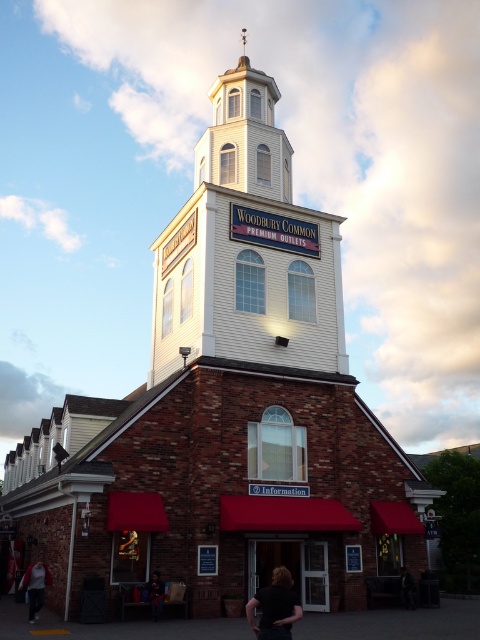
Looking at this image, who is taller, black matte shirt at lower center or dark brown leather jacket at lower center?

Standing taller between the two is black matte shirt at lower center.

Is point (277, 604) more distant than point (408, 589)?

No.

Identify the location of black matte shirt at lower center. The height and width of the screenshot is (640, 480). (275, 608).

Consider the image. Who is shorter, white wooden clock tower at upper center or dark brown leather jacket at lower center?

With less height is dark brown leather jacket at lower center.

Can you confirm if white wooden clock tower at upper center is positioned to the left of dark brown leather jacket at lower center?

Indeed, white wooden clock tower at upper center is positioned on the left side of dark brown leather jacket at lower center.

Image resolution: width=480 pixels, height=640 pixels. What do you see at coordinates (247, 248) in the screenshot?
I see `white wooden clock tower at upper center` at bounding box center [247, 248].

What are the coordinates of `white wooden clock tower at upper center` in the screenshot? It's located at (247, 248).

Is point (290, 612) more distant than point (24, 577)?

No.

Is black matte shirt at lower center further to the viewer compared to dark gray hoodie at lower left?

No, it is not.

At what (x,y) coordinates should I click in order to perform the action: click on black matte shirt at lower center. Please return your answer as a coordinate pair (x, y). Image resolution: width=480 pixels, height=640 pixels. Looking at the image, I should click on (275, 608).